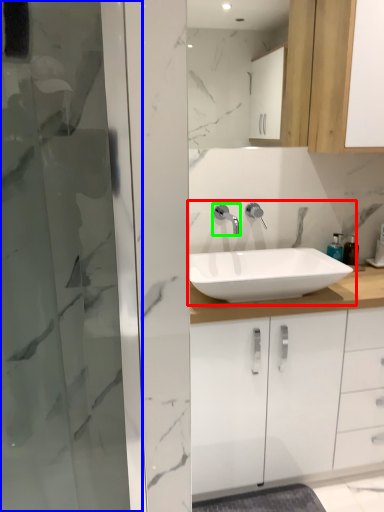
Question: Which object is positioned farthest from sink (highlighted by a red box)? Select from screen door (highlighted by a blue box) and tap (highlighted by a green box).

Choices:
 (A) screen door
 (B) tap

Answer: (A)